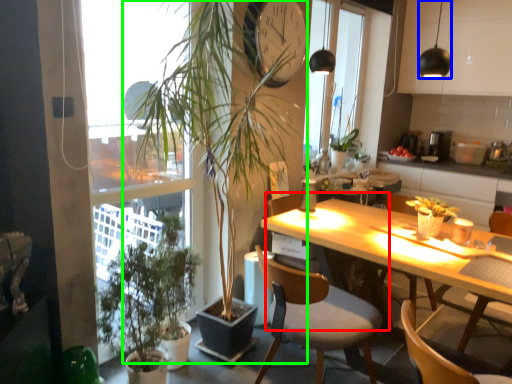
Question: Which object is positioned farthest from chair (highlighted by a red box)? Select from lamp (highlighted by a blue box) and houseplant (highlighted by a green box).

Choices:
 (A) lamp
 (B) houseplant

Answer: (A)